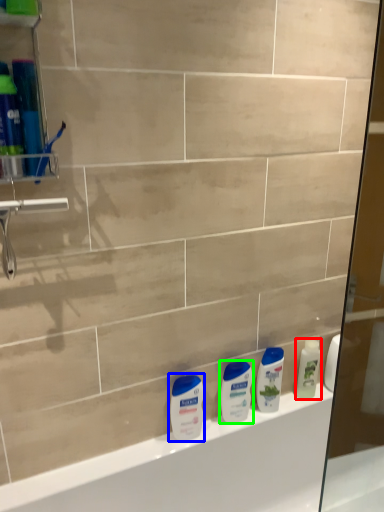
Question: Considering the real-world distances, which object is closest to cleaning product (highlighted by a red box)? toiletry (highlighted by a blue box) or toiletry (highlighted by a green box).

Choices:
 (A) toiletry
 (B) toiletry

Answer: (B)